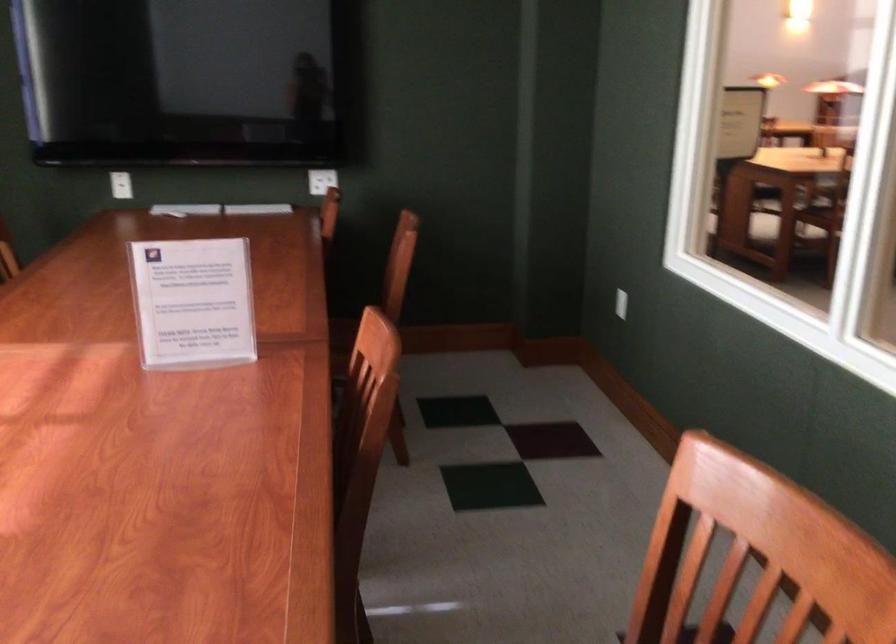
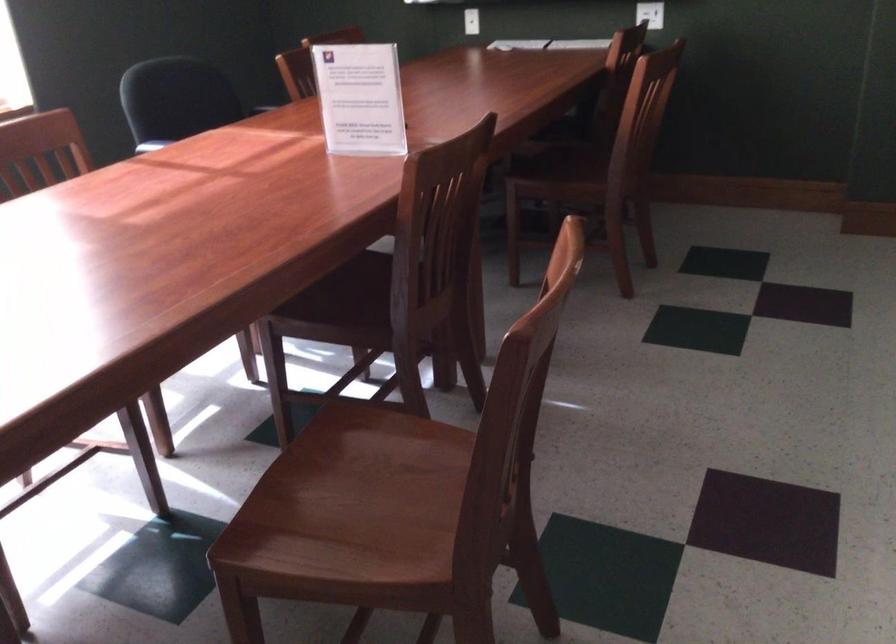
Question: The camera is either moving clockwise (left) or counter-clockwise (right) around the object. The first image is from the beginning of the video and the second image is from the end. Is the camera moving left or right when shooting the video?

Choices:
 (A) Left
 (B) Right

Answer: (B)